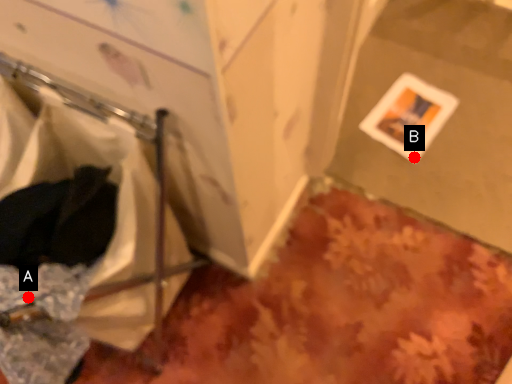
Question: Two points are circled on the image, labeled by A and B beside each circle. Which point is farther to the camera?

Choices:
 (A) A is further
 (B) B is further

Answer: (B)